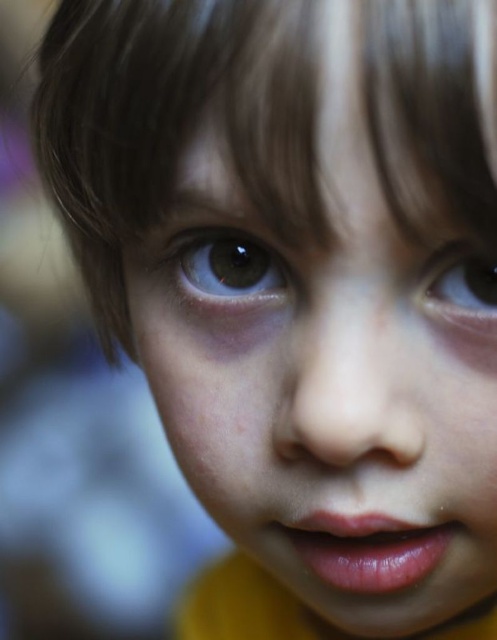
Question: From the image, what is the correct spatial relationship of brown glossy eye at center in relation to brown glossy eye at upper right?

Choices:
 (A) above
 (B) below

Answer: (A)

Question: Which of the following is the closest to the observer?

Choices:
 (A) (456, 314)
 (B) (257, 296)

Answer: (A)

Question: Is brown glossy eye at center positioned before brown glossy eye at upper right?

Choices:
 (A) no
 (B) yes

Answer: (A)

Question: Is brown glossy eye at center above brown glossy eye at upper right?

Choices:
 (A) yes
 (B) no

Answer: (A)